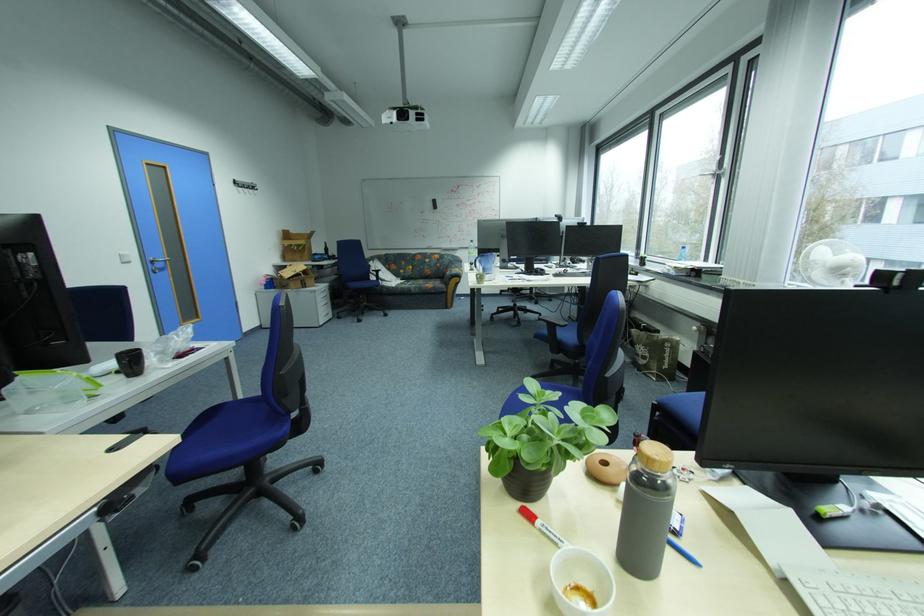
The height and width of the screenshot is (616, 924). In order to click on blue chair sitting surface in this screenshot , I will do `click(225, 439)`.